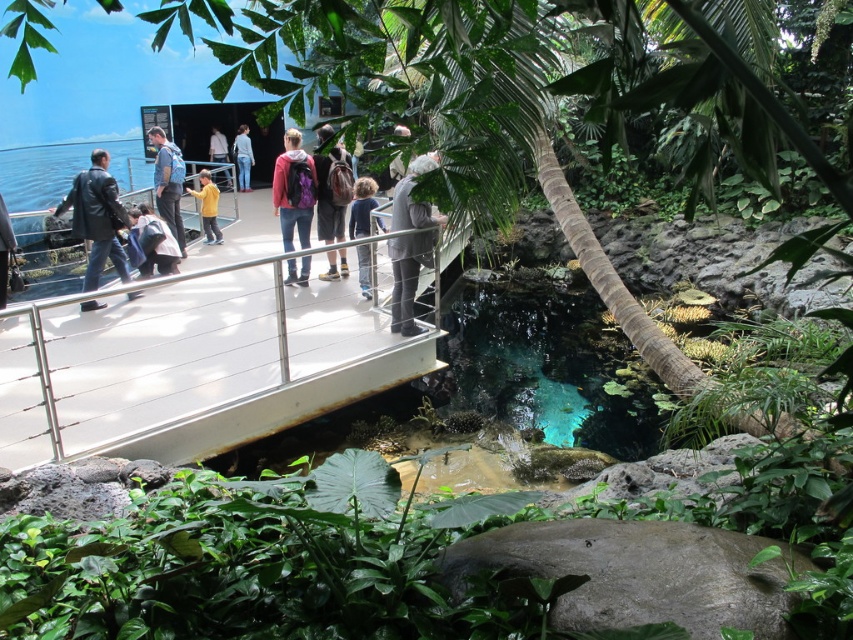
You are a zookeeper who needs to locate the gray fabric jacket at center in the exhibit. Based on the coordinates provided, can you determine its position relative to the raised platform and the water body?

The gray fabric jacket at center is located at coordinates point (410, 244), which places it on the raised platform with metal railings overlooking the water body.

You are standing at the edge of the platform and notice a leather jacket at left on the ground near the water. If you want to retrieve it without leaving the platform, can you reach it?

The leather jacket at left and viewer are 5.91 meters apart, so you cannot reach it without leaving the platform since the distance exceeds typical human reaching range.